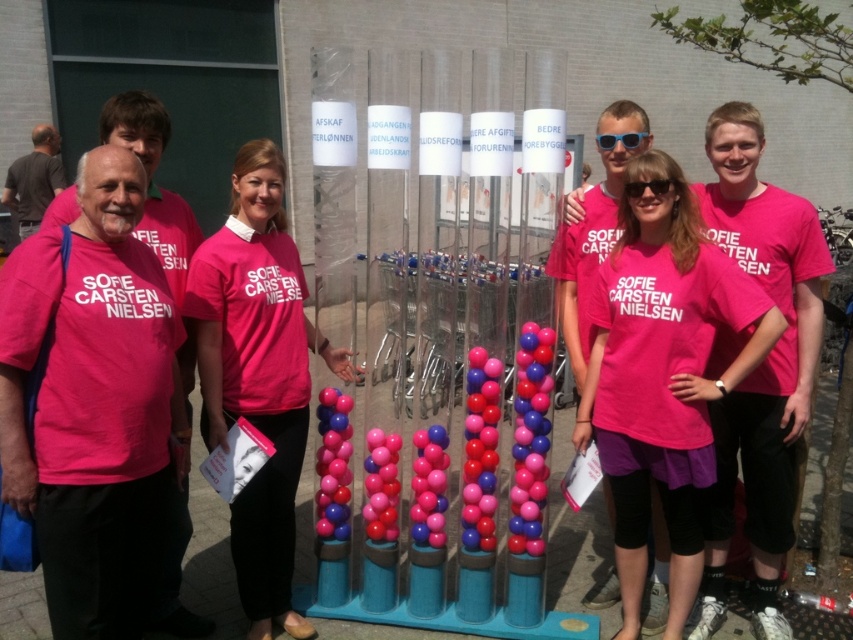
Does pink matte shirt at center have a smaller size compared to pink fabric shirt at center?

No.

Who is shorter, pink matte shirt at center or pink fabric shirt at center?

Standing shorter between the two is pink matte shirt at center.

The width and height of the screenshot is (853, 640). I want to click on pink matte shirt at center, so click(663, 374).

Identify the location of pink matte shirt at center. (663, 374).